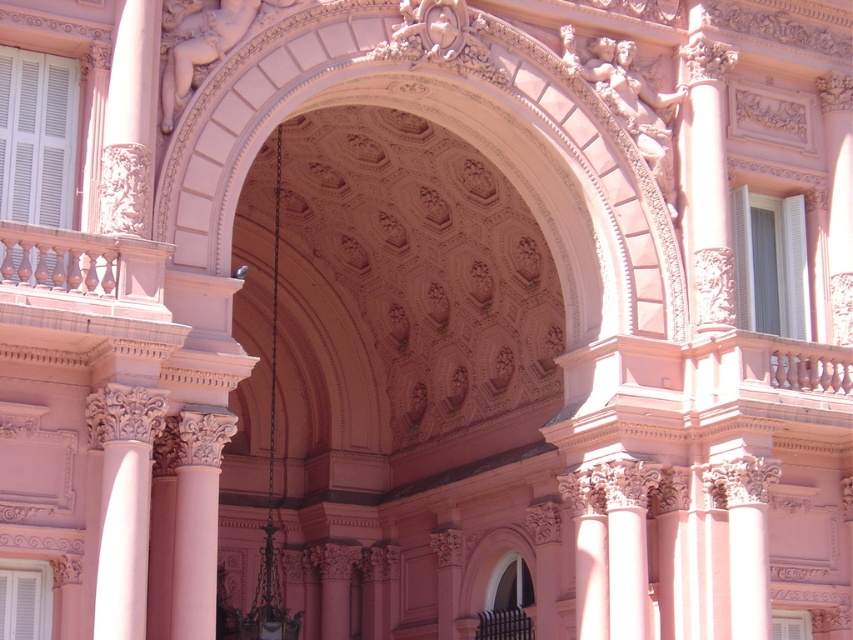
You are an architect reviewing the building facade. You notice the white carved column at center and the pink marble column at center. Which one is located higher up?

The white carved column at center is positioned over the pink marble column at center, so the white carved column at center is higher up.

You are standing at the base of the grand building and want to take a photo of the point at coordinates point (x=122, y=529). If your camera has a maximum focus range of 40 meters, will it be able to capture the point clearly?

The point (x=122, y=529) is 39.86 meters from the camera, which is within the maximum focus range of 40 meters. Therefore, the camera can capture the point clearly.

You are an architect designing a new building and are inspired by this structure. You need to ensure that the smooth pink railing at left and the smooth pink column at center in your design match the proportions seen in the original image. Which object should be taller in your design?

The smooth pink column at center should be taller than the smooth pink railing at left to maintain the proportions seen in the original image, as the smooth pink railing at left is shorter than the smooth pink column at center.